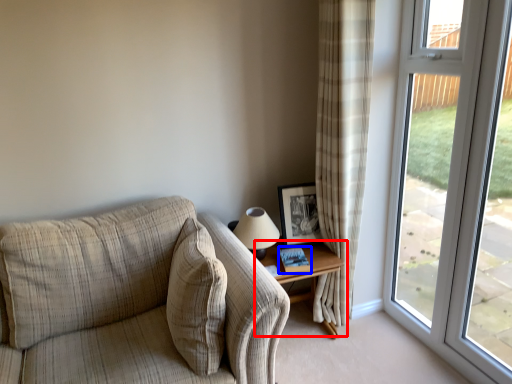
Question: Which of the following is the closest to the observer, table (highlighted by a red box) or book (highlighted by a blue box)?

Choices:
 (A) table
 (B) book

Answer: (A)